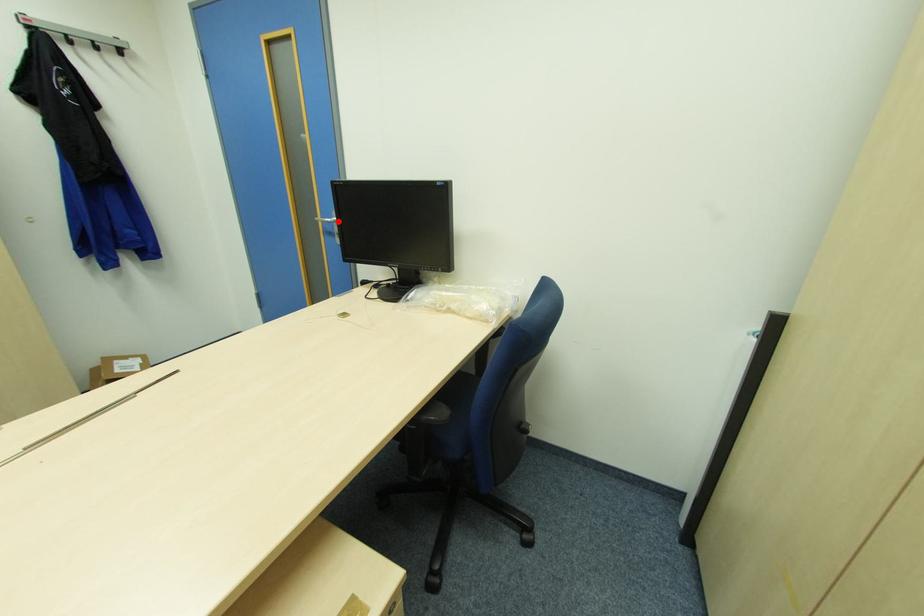
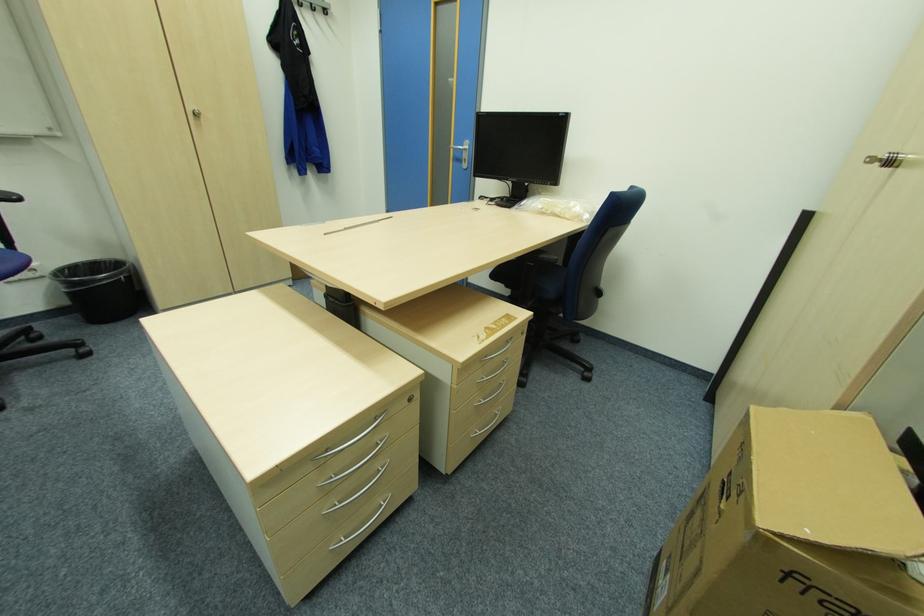
The point at the highlighted location is marked in the first image. Where is the corresponding point in the second image?

(468, 148)